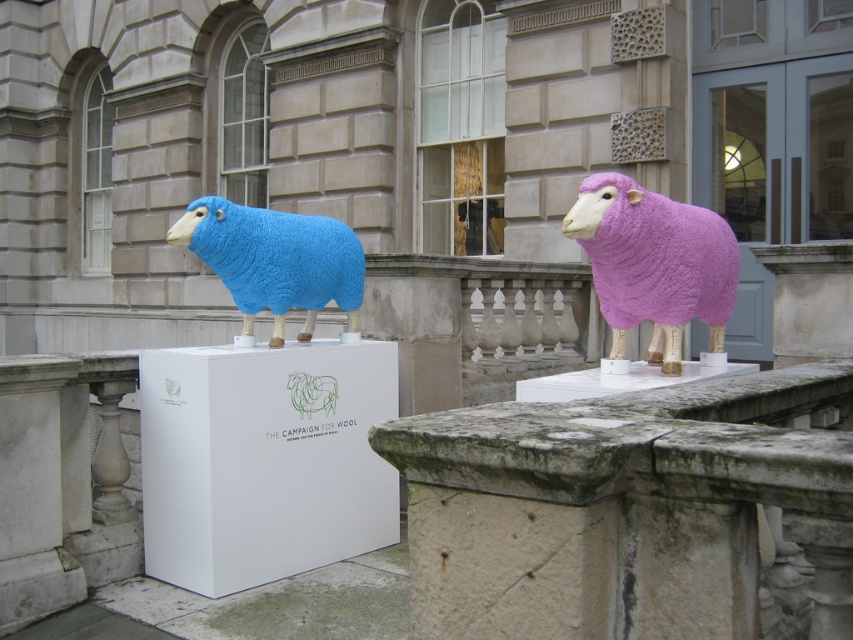
You are standing in front of the classical building and see the pink woolen sheep at center and the matte blue woolen sheep at left. Which sheep is positioned to the right of the other?

The pink woolen sheep at center is to the right of the matte blue woolen sheep at left.

You are standing at the point marked as point (677, 205) in the image. You want to walk to the nearest sheep sculpture. Which one should you go to?

The two sheep sculptures are 3.45 meters apart. Since you are at point (677, 205), you should go to the nearest one based on their positions, but the exact distance from your position to each sheep isn

You are standing in front of the two sheep sculptures and want to touch the point that is closer to you. Which point should you choose between point (650,305) and point (260,211)?

Point (650,305) is closer to the camera than point (260,211), so you should choose point (650,305).